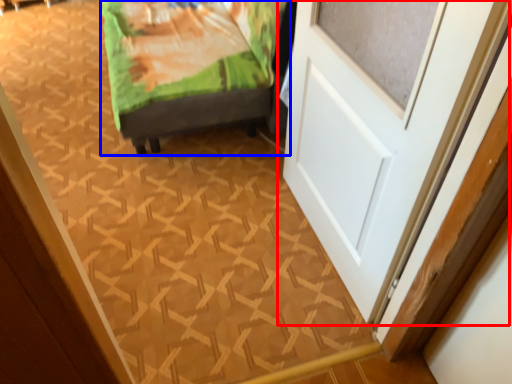
Question: Which object is further to the camera taking this photo, door (highlighted by a red box) or furniture (highlighted by a blue box)?

Choices:
 (A) door
 (B) furniture

Answer: (B)